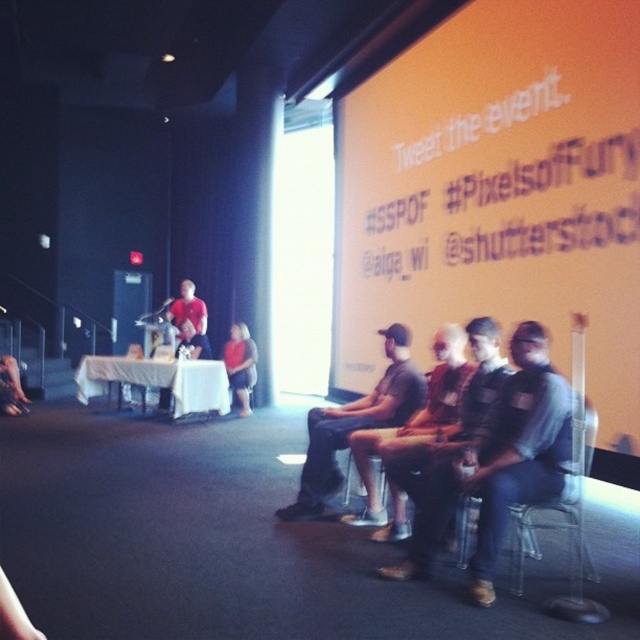
Which of these two, dark gray t-shirt at center or matte red shirt at center, stands shorter?

matte red shirt at center is shorter.

Is dark gray t-shirt at center above matte red shirt at center?

Actually, dark gray t-shirt at center is below matte red shirt at center.

The height and width of the screenshot is (640, 640). Identify the location of dark gray t-shirt at center. (355, 424).

Who is positioned more to the left, dark gray shirt at center or dark gray t-shirt at center?

Positioned to the left is dark gray t-shirt at center.

Is dark gray shirt at center positioned before dark gray t-shirt at center?

Yes, dark gray shirt at center is in front of dark gray t-shirt at center.

Does point (490, 579) come in front of point (330, 410)?

Yes, it is.

Identify the location of dark gray shirt at center. The width and height of the screenshot is (640, 640). (499, 464).

Which of these two, dark gray t-shirt at center or red cotton shirt at center, stands taller?

dark gray t-shirt at center is taller.

Between dark gray t-shirt at center and red cotton shirt at center, which one appears on the left side from the viewer's perspective?

From the viewer's perspective, red cotton shirt at center appears more on the left side.

Does point (420, 388) come farther from viewer compared to point (195, 285)?

That is False.

Identify the location of dark gray t-shirt at center. This screenshot has height=640, width=640. (355, 424).